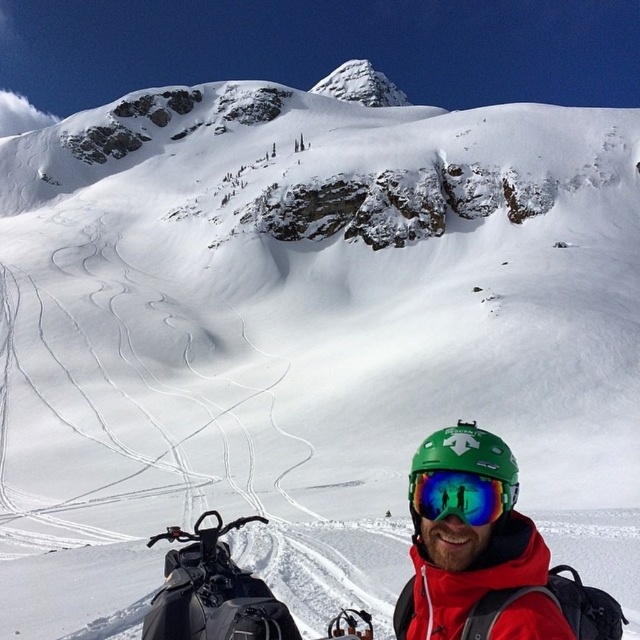
Question: Is green matte helmet at lower center positioned in front of transparent reflective goggles at center?

Choices:
 (A) no
 (B) yes

Answer: (A)

Question: Based on their relative distances, which object is nearer to the transparent reflective goggles at center?

Choices:
 (A) black matte snowmobile at lower left
 (B) green matte helmet at lower center

Answer: (B)

Question: In this image, where is black matte snowmobile at lower left located relative to transparent reflective goggles at center?

Choices:
 (A) right
 (B) left

Answer: (B)

Question: Can you confirm if black matte snowmobile at lower left is bigger than transparent reflective goggles at center?

Choices:
 (A) no
 (B) yes

Answer: (B)

Question: Which of the following is the closest to the observer?

Choices:
 (A) (259, 621)
 (B) (465, 538)
 (C) (452, 474)

Answer: (C)

Question: Which of the following is the farthest from the observer?

Choices:
 (A) (164, 572)
 (B) (460, 470)

Answer: (A)